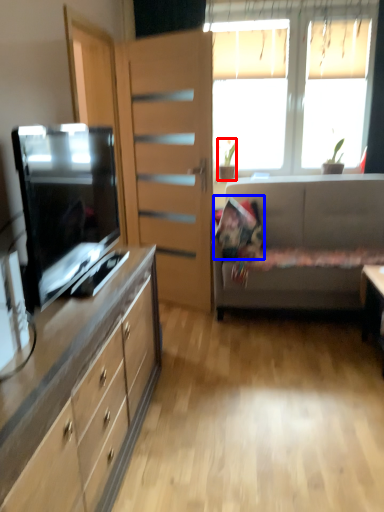
Question: Which object appears farthest to the camera in this image, houseplant (highlighted by a red box) or pillow (highlighted by a blue box)?

Choices:
 (A) houseplant
 (B) pillow

Answer: (A)